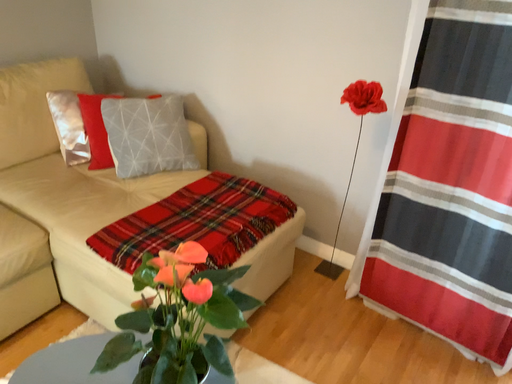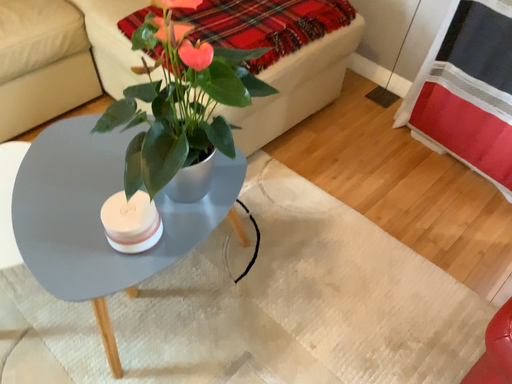
Question: Which way did the camera rotate in the video?

Choices:
 (A) rotated right
 (B) rotated left

Answer: (B)